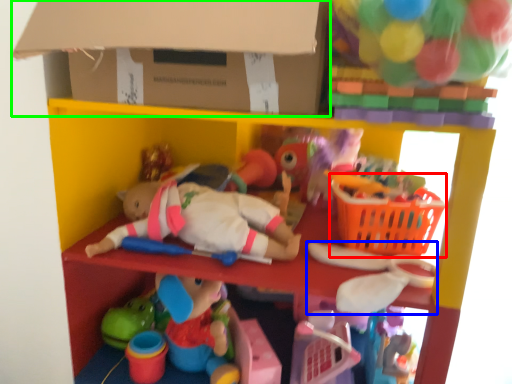
Question: Estimate the real-world distances between objects in this image. Which object is farther from basket (highlighted by a red box), toy (highlighted by a blue box) or cardboard box (highlighted by a green box)?

Choices:
 (A) toy
 (B) cardboard box

Answer: (B)